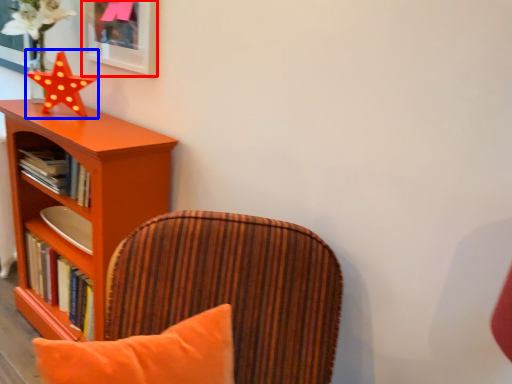
Question: Which of the following is the closest to the observer, picture frame (highlighted by a red box) or star (highlighted by a blue box)?

Choices:
 (A) picture frame
 (B) star

Answer: (A)